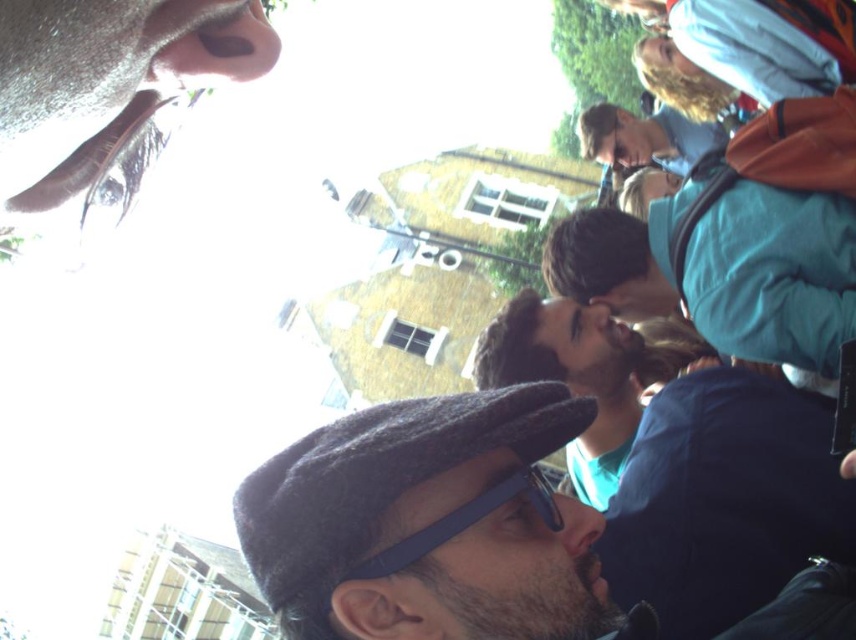
Question: Which point is closer to the camera?

Choices:
 (A) blue rubber goggles at center
 (B) matte brown nose at upper left

Answer: (B)

Question: Is blue rubber goggles at center to the right of matte skin nose at center from the viewer's perspective?

Choices:
 (A) no
 (B) yes

Answer: (A)

Question: Which point is farther to the camera?

Choices:
 (A) blue rubber goggles at center
 (B) matte brown nose at upper left
 (C) matte skin nose at center

Answer: (C)

Question: Is matte blue jacket at upper right above blue rubber goggles at center?

Choices:
 (A) no
 (B) yes

Answer: (B)

Question: Which object is positioned closest to the dark gray wool cap at center?

Choices:
 (A) blue rubber goggles at center
 (B) matte brown nose at upper left
 (C) matte blue jacket at upper right
 (D) matte skin nose at center

Answer: (A)

Question: Is dark gray wool cap at center further to the viewer compared to matte skin nose at center?

Choices:
 (A) yes
 (B) no

Answer: (B)